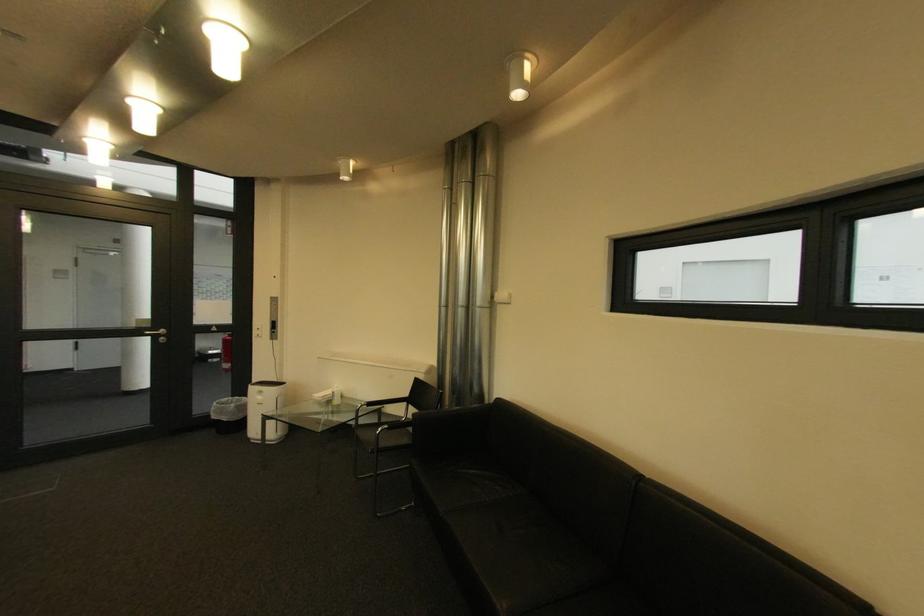
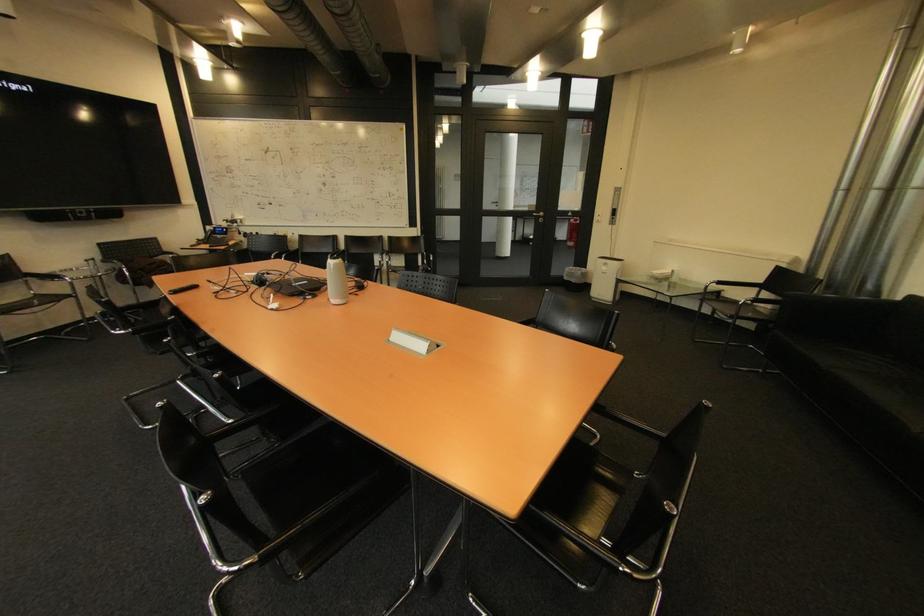
The point at (223, 418) is marked in the first image. Where is the corresponding point in the second image?

(574, 280)